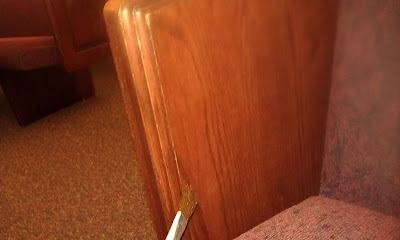
Where is `light reflections`? light reflections is located at coordinates point(125,14), point(139,15).